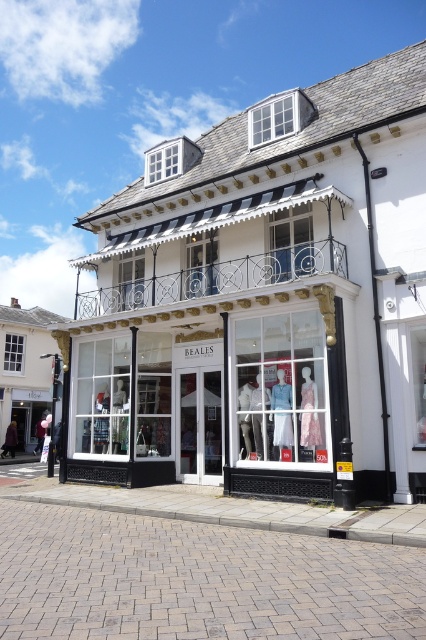
You are a customer standing outside the Beales shop. You notice both the white glass storefront at center and the matte glass mannequins at center. Which object is positioned more to the left from your perspective?

The white glass storefront at center is positioned to the left of the matte glass mannequins at center, so it is more to the left.